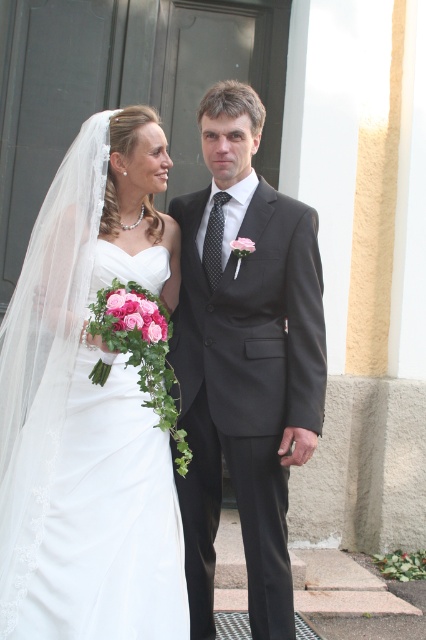
You are a photographer positioned at the entrance of the building where the wedding is taking place. You need to capture a photo that includes both the white satin dress at left and the matte black suit at center. Based on their positions, which one will appear larger in the photo?

The white satin dress at left is closer to the viewer than the matte black suit at center, so it will appear larger in the photo.

You are a photographer positioned at the entrance of the building. You need to ensure that the white satin dress at left and the matte black suit at center are within your camera frame. Given that your camera has a maximum horizontal field of view of 40 centimeters, can both subjects be captured in the same frame?

The white satin dress at left is 44.00 centimeters from the matte black suit at center. Since the distance between them exceeds the camera field of view of 40 centimeters, they cannot both be captured in the same frame.

Consider the image. You are a photographer setting up for the wedding photoshoot. You need to position a backdrop that is 2 meters wide. The backdrop needs to be placed between the white satin dress at left and the matte black suit at center. Will the backdrop fit between them?

The white satin dress at left has a larger size compared to matte black suit at center. However, the description does not provide the exact distance between them. Therefore, it is unclear if the 2 meter wide backdrop will fit between them.